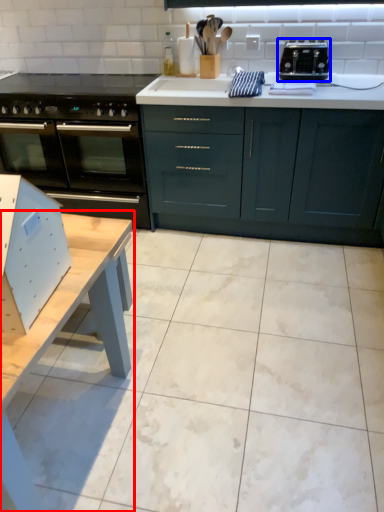
Question: Among these objects, which one is nearest to the camera, table (highlighted by a red box) or toaster (highlighted by a blue box)?

Choices:
 (A) table
 (B) toaster

Answer: (A)